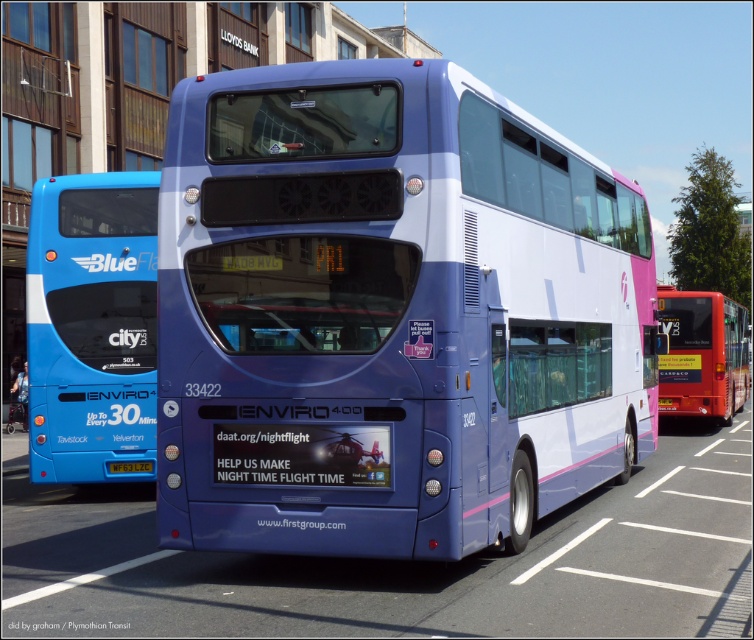
Question: From the image, what is the correct spatial relationship of red matte bus at right in relation to yellow plastic license plate at center?

Choices:
 (A) right
 (B) left

Answer: (A)

Question: Among these points, which one is farthest from the camera?

Choices:
 (A) (149, 272)
 (B) (707, 406)

Answer: (B)

Question: Which object is positioned farthest from the red matte bus at right?

Choices:
 (A) matte purple bus at center
 (B) blue glossy bus at left

Answer: (A)

Question: Can you confirm if matte purple bus at center is bigger than blue glossy bus at left?

Choices:
 (A) yes
 (B) no

Answer: (B)

Question: Among these points, which one is farthest from the camera?

Choices:
 (A) (146, 464)
 (B) (112, 244)
 (C) (480, 124)

Answer: (B)

Question: Does red matte bus at right have a larger size compared to yellow plastic license plate at center?

Choices:
 (A) no
 (B) yes

Answer: (B)